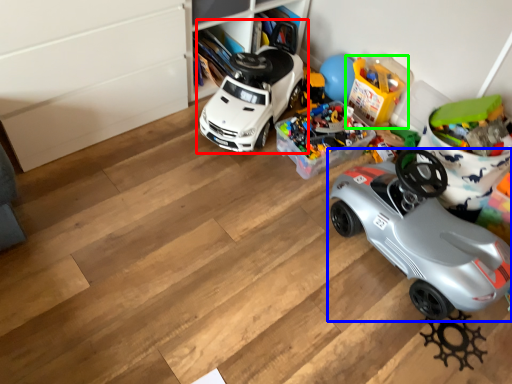
Question: Considering the real-world distances, which object is closest to car (highlighted by a red box)? car (highlighted by a blue box) or toy (highlighted by a green box).

Choices:
 (A) car
 (B) toy

Answer: (B)